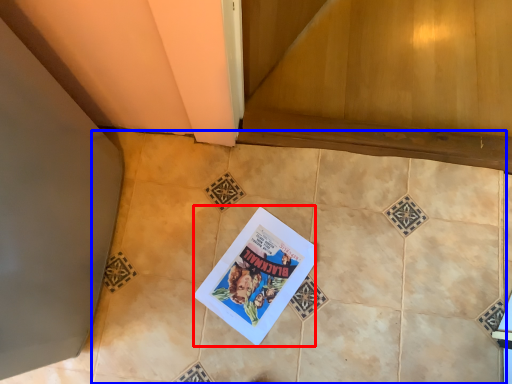
Question: Which object is closer to the camera taking this photo, comic book (highlighted by a red box) or ceramic tile (highlighted by a blue box)?

Choices:
 (A) comic book
 (B) ceramic tile

Answer: (B)